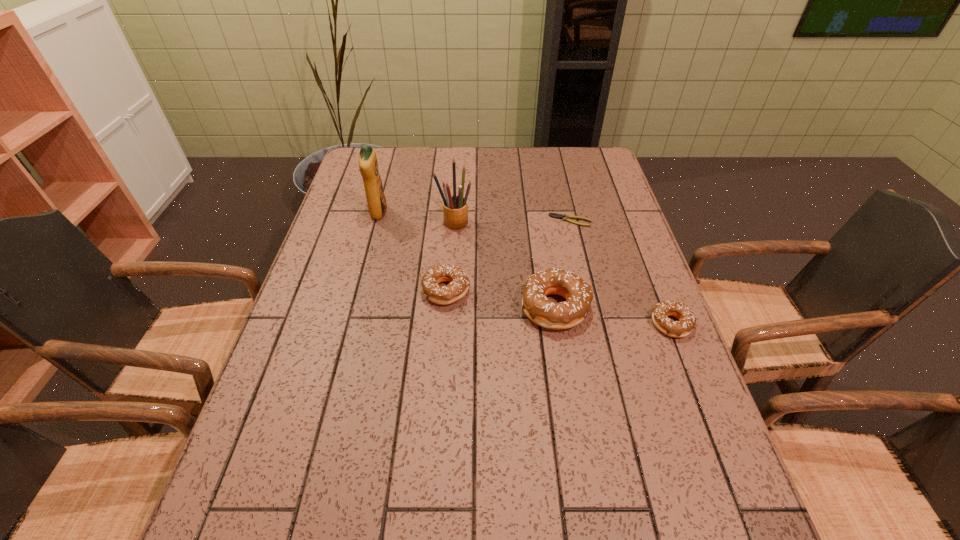
This screenshot has height=540, width=960. Identify the location of the third shortest object. point(459,283).

Where is `the second shortest doughnut`? This screenshot has width=960, height=540. the second shortest doughnut is located at coordinates coord(459,283).

The height and width of the screenshot is (540, 960). Identify the location of the second doughnut from left to right. (541, 310).

Where is `the tallest doughnut`? the tallest doughnut is located at coordinates (541, 310).

Image resolution: width=960 pixels, height=540 pixels. I want to click on the shortest doughnut, so click(683, 327).

The width and height of the screenshot is (960, 540). Find the location of `the fifth tallest object`. the fifth tallest object is located at coordinates (683, 327).

What are the coordinates of `pencil box` in the screenshot? It's located at (455, 208).

Identify the location of detergent. The height and width of the screenshot is (540, 960). (368, 165).

Locate an element on the screen. the tallest object is located at coordinates (368, 165).

Locate an element on the screen. Image resolution: width=960 pixels, height=540 pixels. the shortest object is located at coordinates (564, 217).